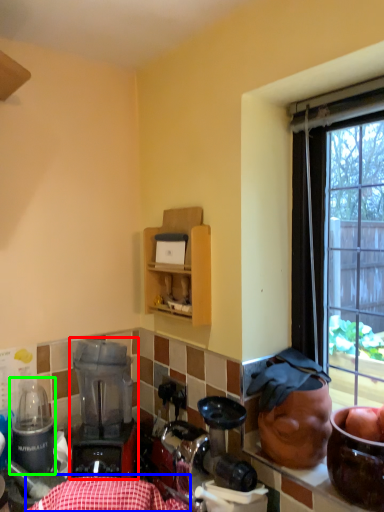
Question: Which object is the closest to the blender (highlighted by a red box)? Choose among these: tablecloth (highlighted by a blue box) or appliance (highlighted by a green box).

Choices:
 (A) tablecloth
 (B) appliance

Answer: (B)